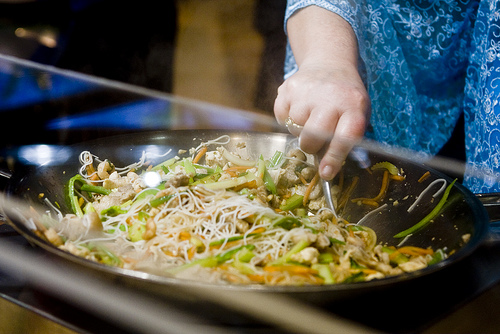
Identify the location of wok. The height and width of the screenshot is (334, 500). (440, 225).